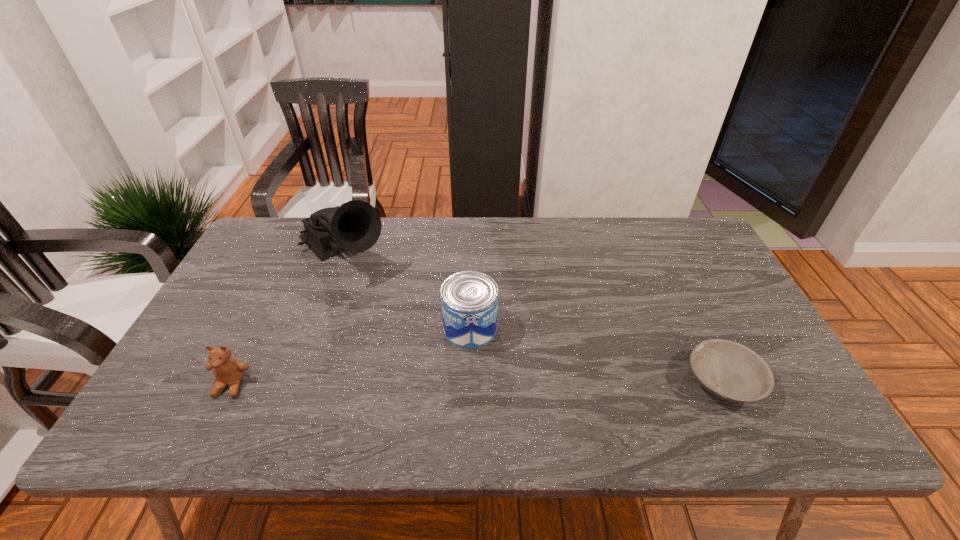
Find the location of a particular element. teddy bear is located at coordinates (228, 371).

This screenshot has width=960, height=540. I want to click on the shortest object, so click(x=728, y=370).

What are the coordinates of `the rightmost object` in the screenshot? It's located at (728, 370).

Identify the location of the tallest object. (355, 226).

Find the location of a particular element. phonograph_record is located at coordinates (355, 226).

In order to click on the second farthest object in this screenshot , I will do (x=469, y=300).

The width and height of the screenshot is (960, 540). I want to click on the third object from left to right, so click(469, 300).

The image size is (960, 540). I want to click on vacant space located on the left of the shortest object, so click(x=544, y=381).

At what (x,y) coordinates should I click in order to perform the action: click on free space located from the horn of the phonograph_record. Please return your answer as a coordinate pair (x, y). The image size is (960, 540). Looking at the image, I should click on (382, 295).

Where is `free region located from the horn of the phonograph_record`? Image resolution: width=960 pixels, height=540 pixels. free region located from the horn of the phonograph_record is located at coordinates (425, 339).